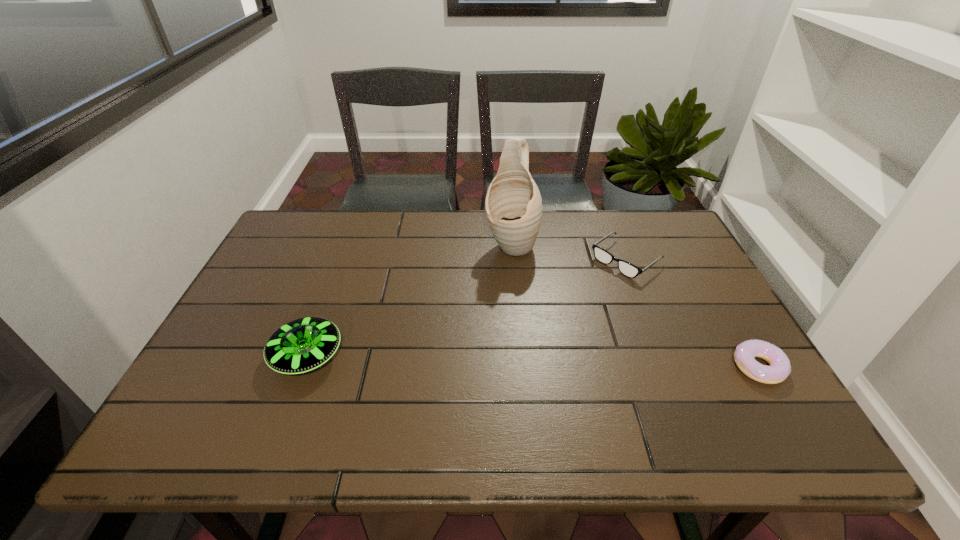
I want to click on vacant spot on the desktop that is between the saucer and the doughnut and is positioned on the front-facing side of the spectacles, so click(x=494, y=360).

Locate an element on the screen. This screenshot has width=960, height=540. free space on the desktop that is between the leftmost object and the rightmost object and is positioned at the spout of the pitcher is located at coordinates (468, 360).